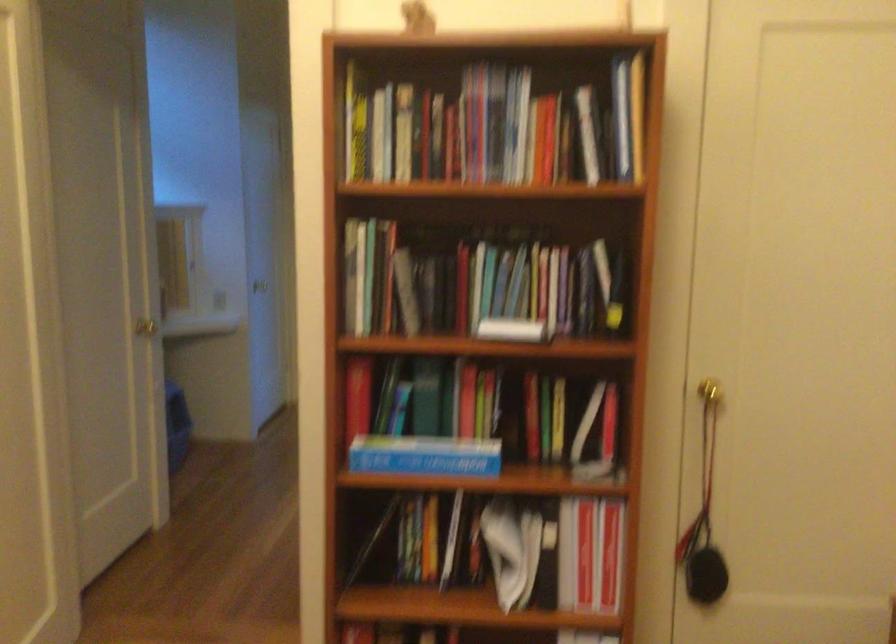
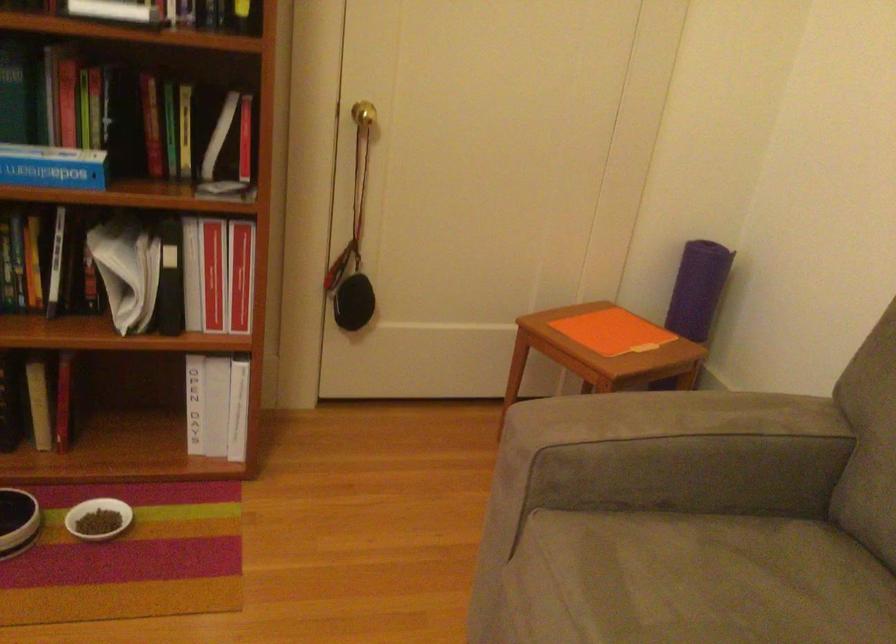
The first image is from the beginning of the video and the second image is from the end. How did the camera likely rotate when shooting the video?

The rotation direction of the camera is right-down.